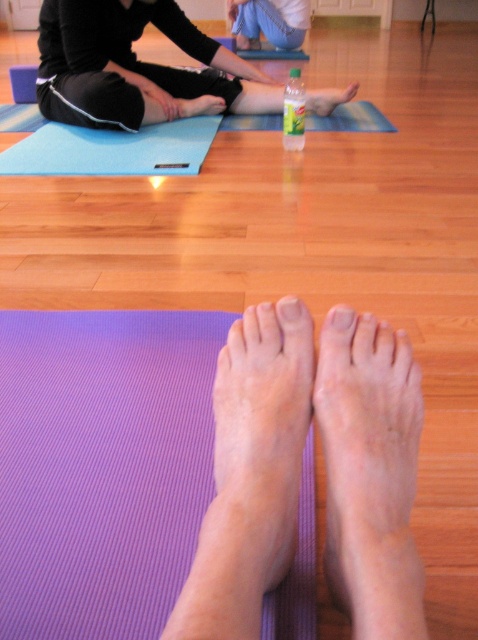
Question: Which object is farther from the camera taking this photo?

Choices:
 (A) blue textured yoga mat at upper center
 (B) smooth skin foot at center
 (C) dry skin feet at lower center
 (D) purple textured yoga mat at lower center

Answer: (B)

Question: Observing the image, what is the correct spatial positioning of purple textured yoga mat at lower center in reference to blue denim jeans at upper center?

Choices:
 (A) above
 (B) below

Answer: (B)

Question: Does black matte leggings at upper center have a greater width compared to pale skin toe at center?

Choices:
 (A) yes
 (B) no

Answer: (A)

Question: Which point is farther to the camera?

Choices:
 (A) purple textured yoga mat at lower center
 (B) pale skin toe at center
 (C) matte plastic toe at center
 (D) dry skin feet at lower center

Answer: (C)

Question: Is blue denim jeans at upper center thinner than pale skin toe at center?

Choices:
 (A) yes
 (B) no

Answer: (B)

Question: Considering the real-world distances, which object is closest to the blue textured yoga mat at upper center?

Choices:
 (A) dry skin feet at lower center
 (B) purple textured yoga mat at lower center
 (C) blue denim jeans at upper center
 (D) dry skin feet at center

Answer: (B)